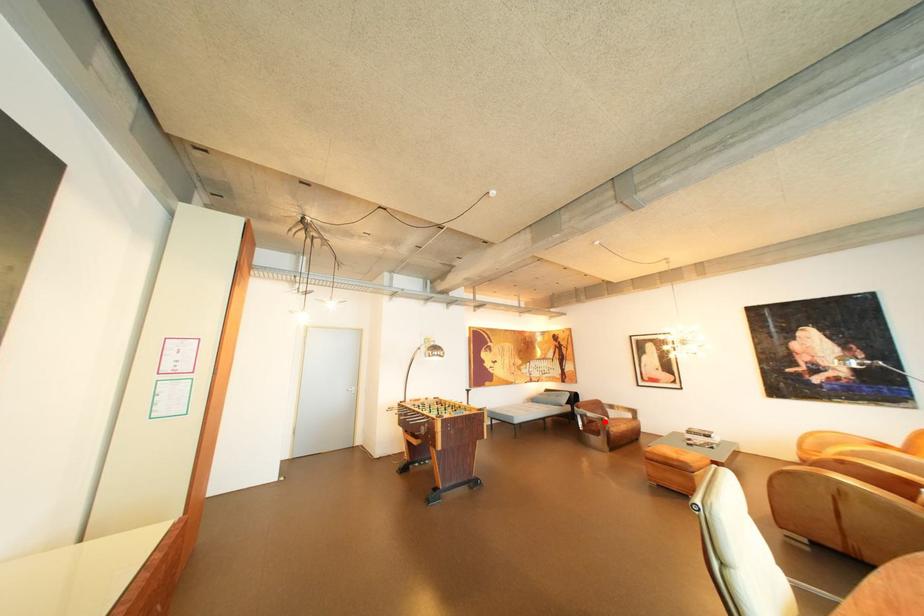
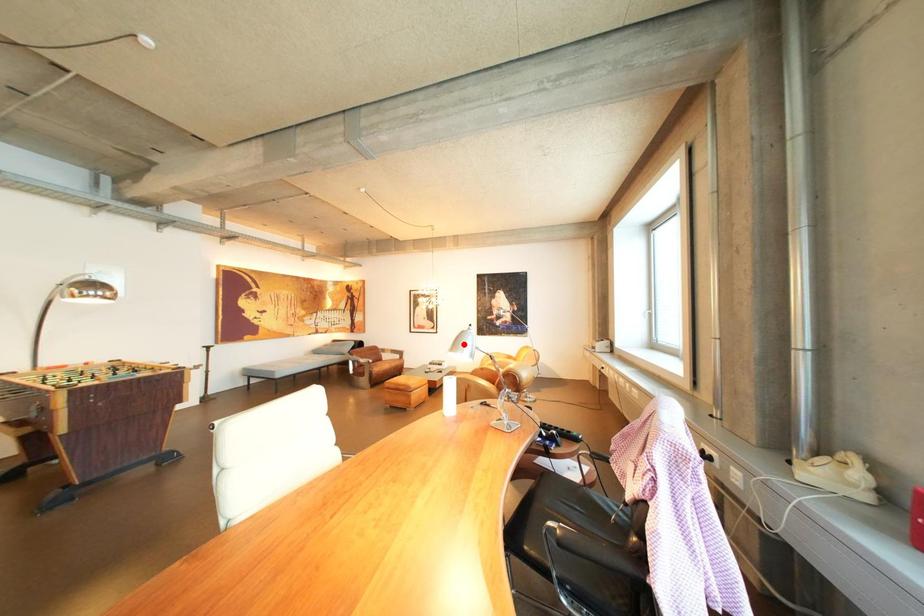
I am providing you with two images of the same scene from different viewpoints. A red point is marked on the first image and another point is marked on the second image. Is the marked point in image1 the same physical position as the marked point in image2?

No